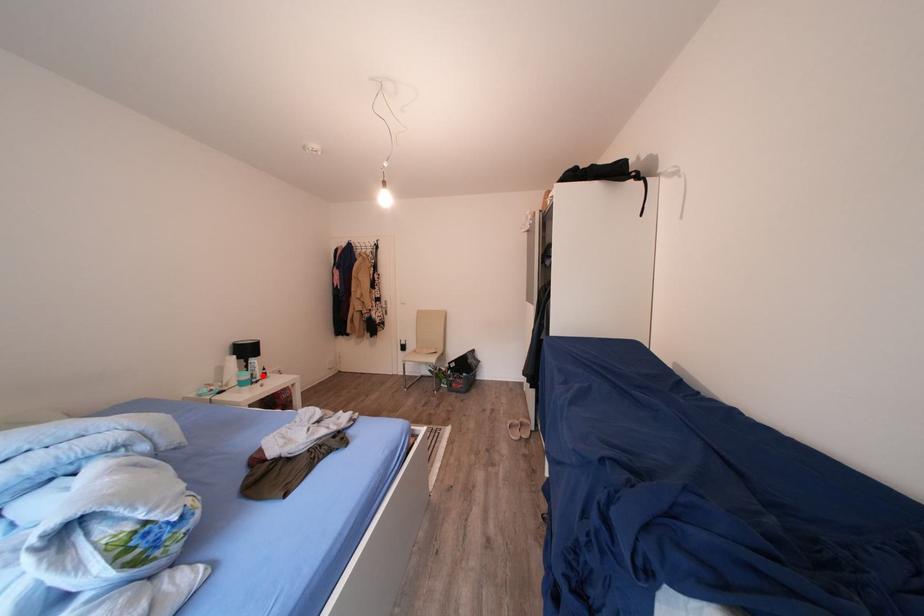
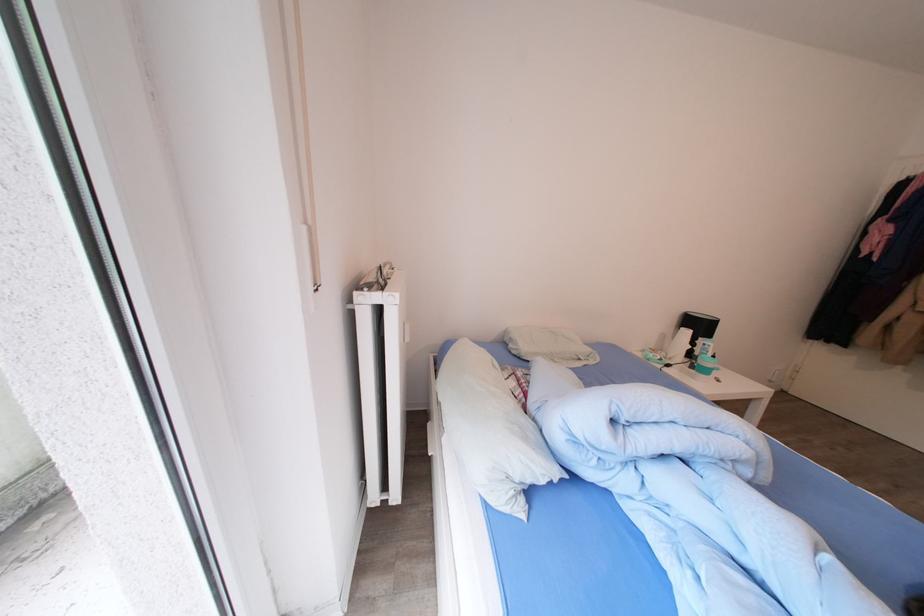
Where in the second image is the point corresponding to the highlighted location from the first image?

(712, 360)